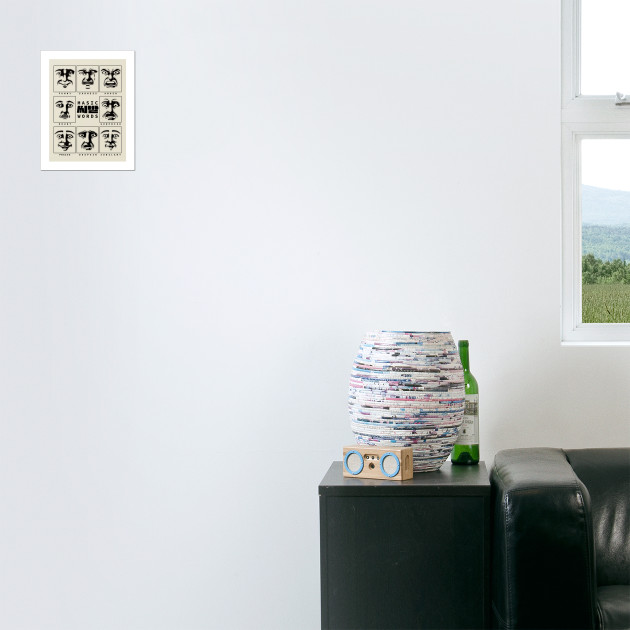
Where is `corners of wall art`? The image size is (630, 630). corners of wall art is located at coordinates (41, 168), (134, 166), (130, 50), (43, 53).